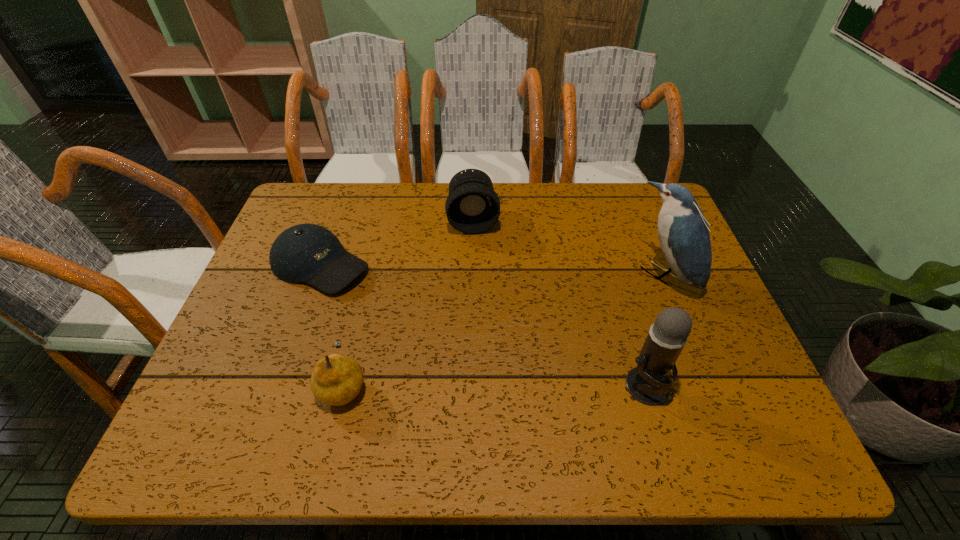
You are a GUI agent. You are given a task and a screenshot of the screen. Output one action in this format:
    pyautogui.click(x=<x>, y=<y>)
    Task: Click on the free spot on the desktop that is between the second shortest object and the microphone and is positioned at the tip of the rightmost object's beak
    The width and height of the screenshot is (960, 540).
    Given the screenshot: What is the action you would take?
    pyautogui.click(x=518, y=385)

This screenshot has height=540, width=960. What are the coordinates of `vacant space on the desktop that is between the pear and the microphone and is positioned on the front-facing side of the baseball cap` in the screenshot? It's located at (538, 385).

Identify the location of free space on the desktop that is between the pear and the microphone and is positioned at the front element of the third object from left to right. The height and width of the screenshot is (540, 960). (490, 384).